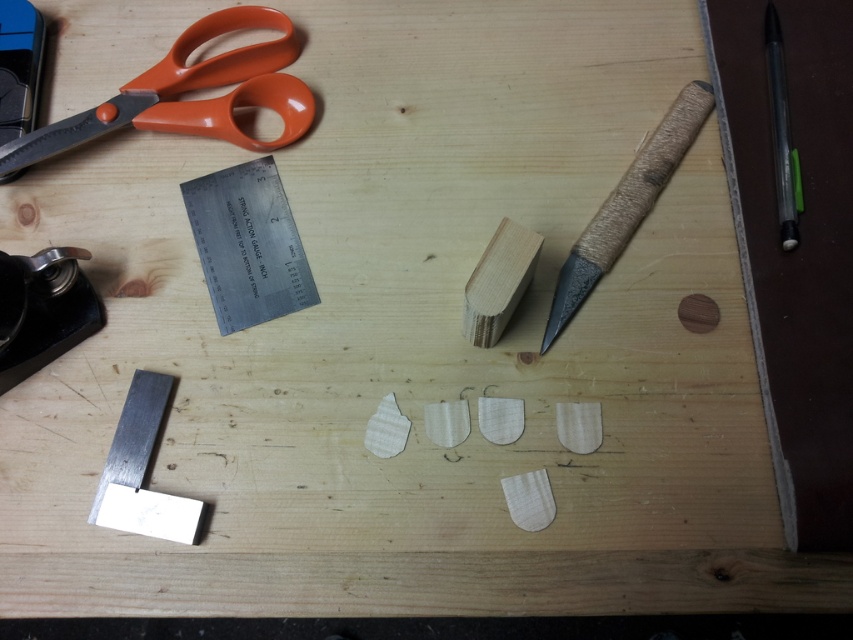
Question: Which object is positioned farthest from the black plastic pen at upper right?

Choices:
 (A) orange plastic scissors at upper left
 (B) metallic black stapler at lower left
 (C) wooden textured pencil at upper right

Answer: (B)

Question: Which is farther from the black plastic pen at upper right?

Choices:
 (A) metallic black stapler at lower left
 (B) wooden textured pencil at upper right

Answer: (A)

Question: Does wooden textured pencil at upper right have a lesser width compared to metallic black stapler at lower left?

Choices:
 (A) yes
 (B) no

Answer: (B)

Question: Can you confirm if orange plastic scissors at upper left is positioned below metallic black stapler at lower left?

Choices:
 (A) yes
 (B) no

Answer: (B)

Question: Is orange plastic scissors at upper left in front of metallic black stapler at lower left?

Choices:
 (A) no
 (B) yes

Answer: (A)

Question: Which of these objects is positioned farthest from the black plastic pen at upper right?

Choices:
 (A) metallic black stapler at lower left
 (B) wooden textured pencil at upper right

Answer: (A)